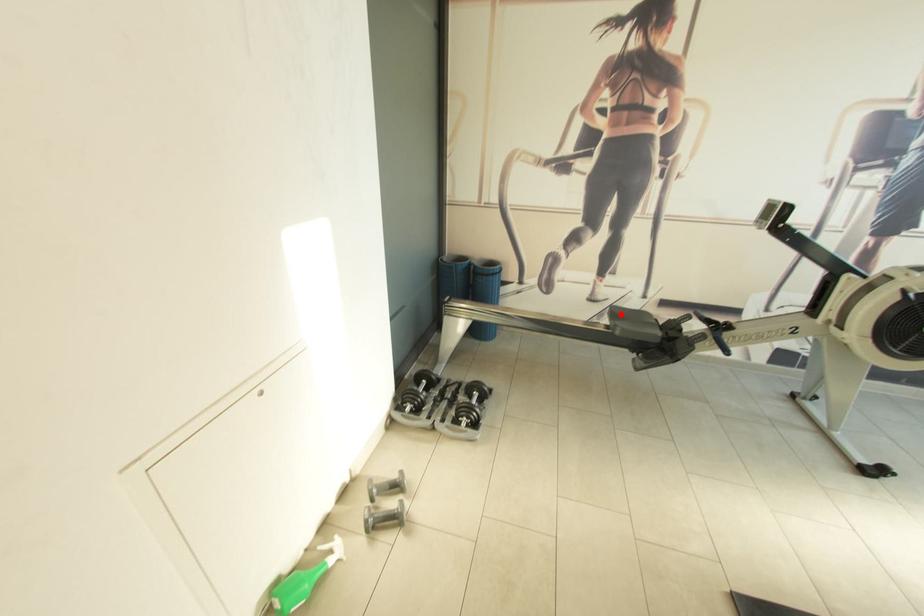
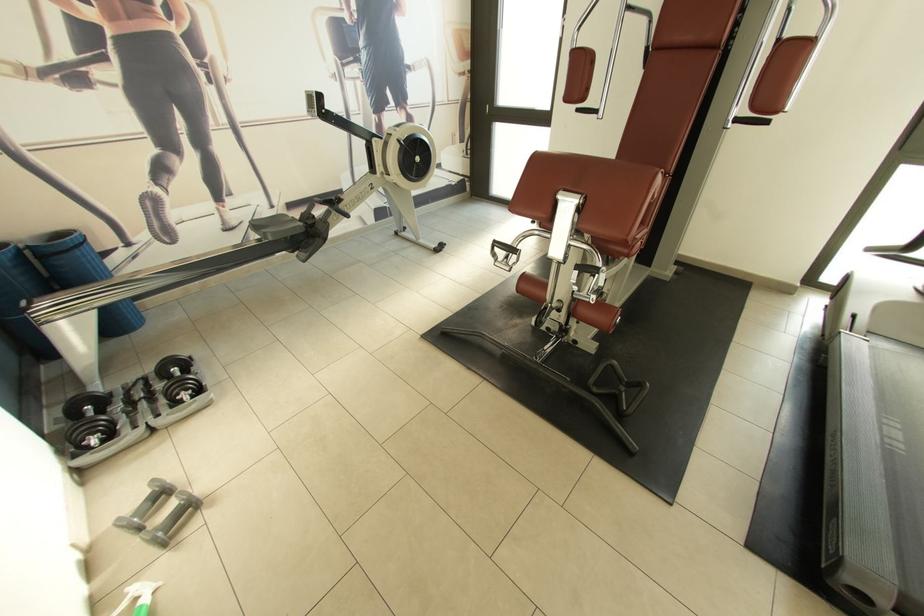
The point at the highlighted location is marked in the first image. Where is the corresponding point in the second image?

(262, 227)